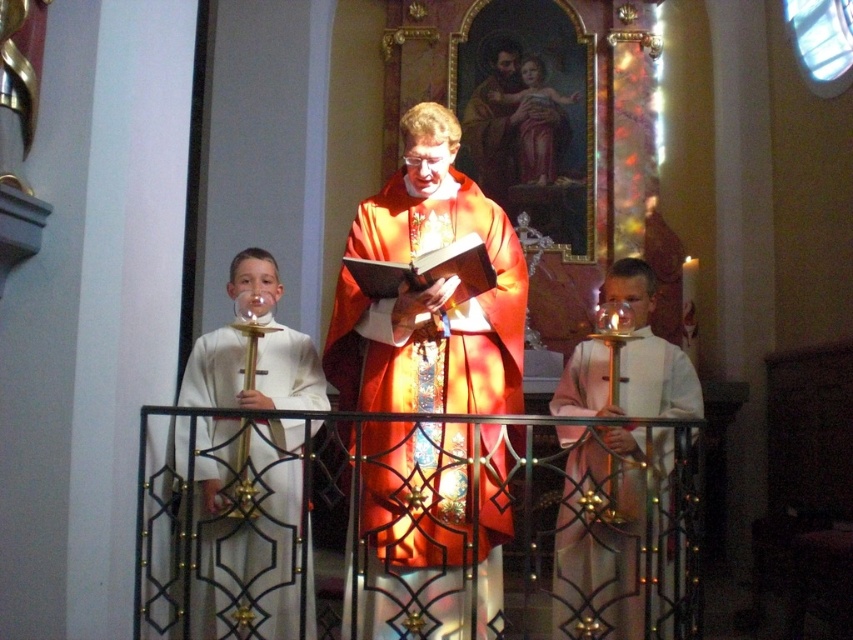
Who is more distant from viewer, (364,387) or (209,356)?

The point (209,356) is behind.

Can you confirm if shiny orange robe at center is bigger than white satin robe at left?

Yes, shiny orange robe at center is bigger than white satin robe at left.

The width and height of the screenshot is (853, 640). What do you see at coordinates (428, 291) in the screenshot? I see `shiny orange robe at center` at bounding box center [428, 291].

The width and height of the screenshot is (853, 640). Find the location of `shiny orange robe at center`. shiny orange robe at center is located at coordinates (428, 291).

Is pink satin robe at right taller than matte gold statue at upper center?

Correct, pink satin robe at right is much taller as matte gold statue at upper center.

Who is more distant from viewer, [665,547] or [527,92]?

Point [527,92]

Does point (621, 456) come behind point (564, 141)?

No, it is not.

Image resolution: width=853 pixels, height=640 pixels. I want to click on pink satin robe at right, so click(614, 536).

Between white satin robe at left and pink satin robe at right, which one is positioned higher?

white satin robe at left is higher up.

Is white satin robe at left bigger than pink satin robe at right?

No, white satin robe at left is not bigger than pink satin robe at right.

Is point (305, 632) less distant than point (573, 371)?

Yes, it is in front of point (573, 371).

The height and width of the screenshot is (640, 853). Find the location of `white satin robe at left`. white satin robe at left is located at coordinates (250, 532).